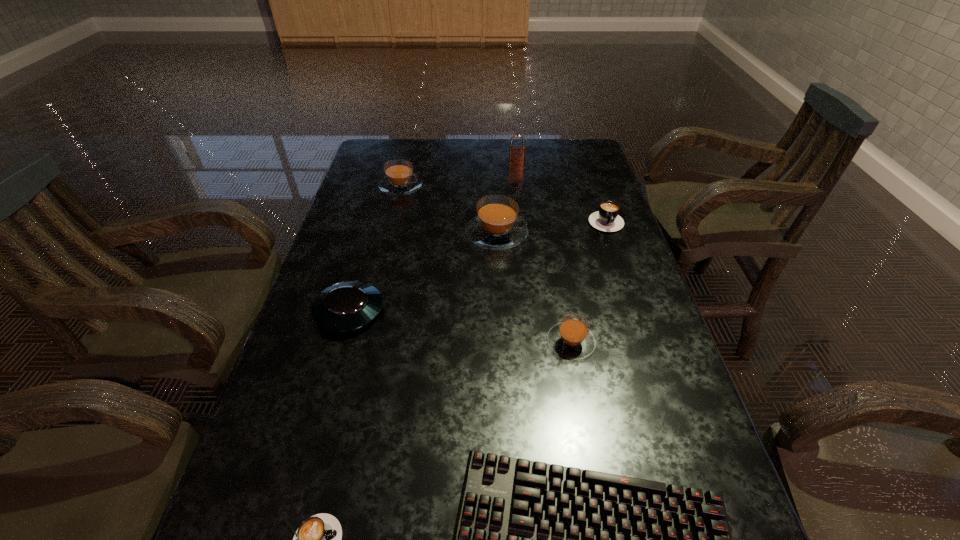
At what (x,y) coordinates should I click in order to perform the action: click on object at the right edge. Please return your answer as a coordinate pair (x, y). Image resolution: width=960 pixels, height=540 pixels. Looking at the image, I should click on (607, 219).

Where is `free location at the far edge of the desktop`? This screenshot has width=960, height=540. free location at the far edge of the desktop is located at coordinates (439, 147).

In the image, there is a desktop. Where is `vacant region at the left edge`? The width and height of the screenshot is (960, 540). vacant region at the left edge is located at coordinates (241, 475).

This screenshot has width=960, height=540. In order to click on free space at the right edge of the desktop in this screenshot , I will do `click(643, 282)`.

Locate an element on the screen. Image resolution: width=960 pixels, height=540 pixels. free space at the far left corner of the desktop is located at coordinates (373, 159).

Find the location of a particular element. This screenshot has height=540, width=960. free region at the far right corner is located at coordinates (551, 141).

Find the location of `vacant region between the nearest brown cappuccino and the right black cappuccino`. vacant region between the nearest brown cappuccino and the right black cappuccino is located at coordinates (588, 281).

What are the coordinates of `free space between the second tallest cappuccino and the second cappuccino from right to left` in the screenshot? It's located at (486, 265).

The image size is (960, 540). I want to click on free space between the fourth cappuccino from left to right and the padlock, so click(x=543, y=253).

Locate an element on the screen. The width and height of the screenshot is (960, 540). free spot between the saucer and the brown padlock is located at coordinates (433, 238).